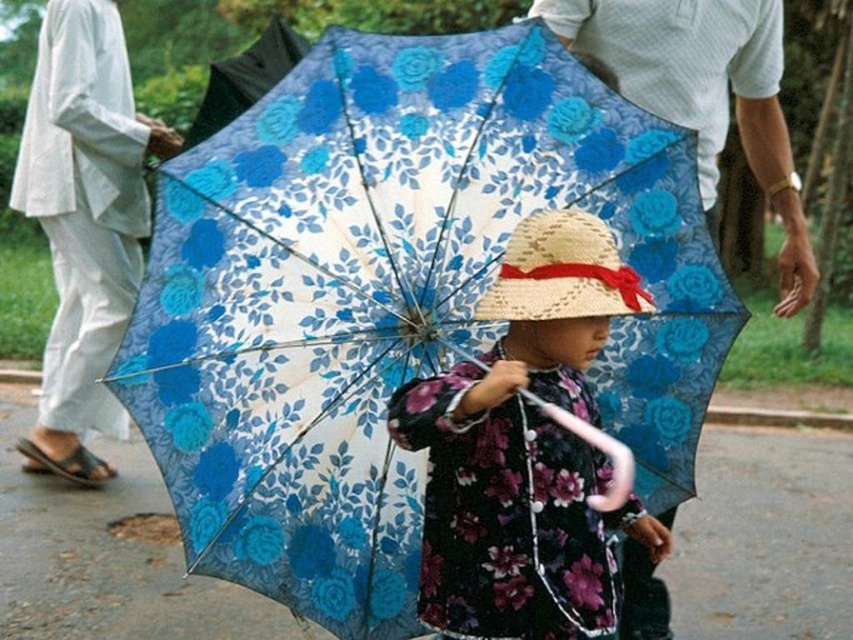
Find the location of a particular element. The image size is (853, 640). transparent floral-patterned umbrella at center is located at coordinates (393, 300).

Does transparent floral-patterned umbrella at center have a smaller size compared to white textured shirt at upper right?

No, transparent floral-patterned umbrella at center is not smaller than white textured shirt at upper right.

Image resolution: width=853 pixels, height=640 pixels. I want to click on transparent floral-patterned umbrella at center, so click(393, 300).

Can you confirm if floral-patterned fabric dress at center is positioned above straw hat at center?

Incorrect, floral-patterned fabric dress at center is not positioned above straw hat at center.

Between floral-patterned fabric dress at center and straw hat at center, which one has less height?

straw hat at center is shorter.

Image resolution: width=853 pixels, height=640 pixels. In order to click on floral-patterned fabric dress at center in this screenshot , I will do `click(521, 445)`.

Who is positioned more to the right, white textured shirt at upper right or straw hat at center?

Positioned to the right is white textured shirt at upper right.

Who is more distant from viewer, (x=811, y=288) or (x=606, y=227)?

Positioned behind is point (x=811, y=288).

You are a GUI agent. You are given a task and a screenshot of the screen. Output one action in this format:
    pyautogui.click(x=<x>, y=<y>)
    Task: Click on the white textured shirt at upper right
    This screenshot has width=853, height=640.
    Given the screenshot: What is the action you would take?
    pyautogui.click(x=703, y=93)